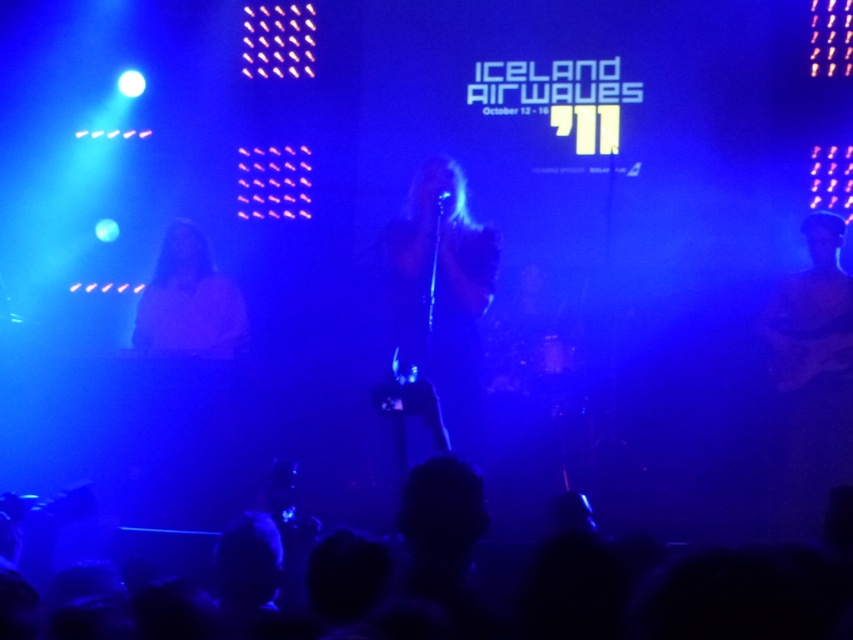
Can you confirm if black matte shirt at center is positioned to the right of matte white shirt at center?

Indeed, black matte shirt at center is positioned on the right side of matte white shirt at center.

Does point (418, 196) come behind point (166, 259)?

No, it is not.

Identify the location of black matte shirt at center. This screenshot has height=640, width=853. (444, 294).